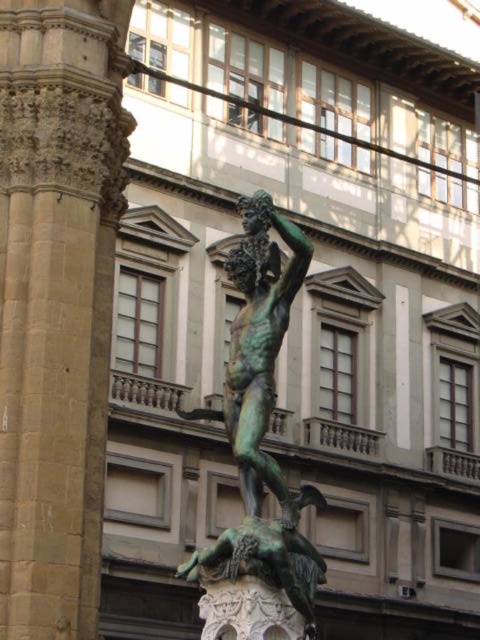
Question: Observing the image, what is the correct spatial positioning of smooth stone pillar at center in reference to green patina bronze at center?

Choices:
 (A) left
 (B) right

Answer: (A)

Question: Which object appears farthest from the camera in this image?

Choices:
 (A) smooth stone pillar at center
 (B) green patina bronze at center

Answer: (A)

Question: Does smooth stone pillar at center appear over green patina bronze at center?

Choices:
 (A) no
 (B) yes

Answer: (B)

Question: Can you confirm if smooth stone pillar at center is positioned above green patina bronze at center?

Choices:
 (A) yes
 (B) no

Answer: (A)

Question: Which point is farther to the camera?

Choices:
 (A) (9, 44)
 (B) (308, 243)

Answer: (A)